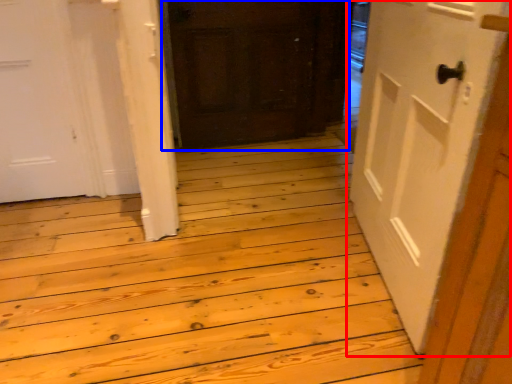
Question: Which point is further to the camera, door (highlighted by a red box) or door (highlighted by a blue box)?

Choices:
 (A) door
 (B) door

Answer: (B)